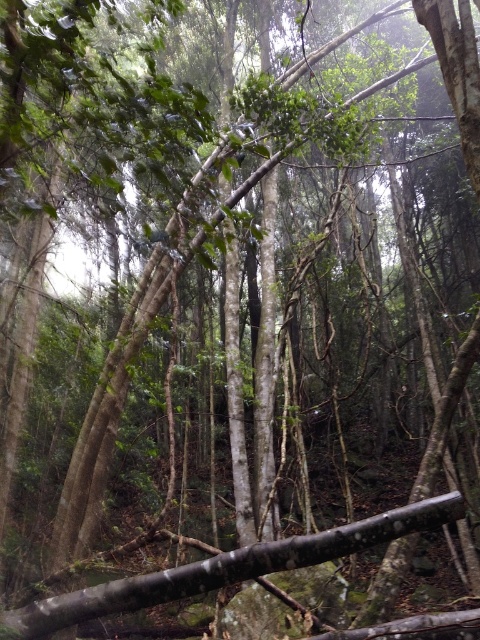
Question: Which of the following is the closest to the observer?

Choices:
 (A) (309, 608)
 (B) (197, 589)

Answer: (B)

Question: Is smooth brown branch at center wider than smooth brown rock at center?

Choices:
 (A) yes
 (B) no

Answer: (A)

Question: Which object appears farthest from the camera in this image?

Choices:
 (A) smooth brown rock at center
 (B) smooth brown branch at center

Answer: (A)

Question: Does smooth brown branch at center have a lesser width compared to smooth brown rock at center?

Choices:
 (A) yes
 (B) no

Answer: (B)

Question: Which point is closer to the camera?

Choices:
 (A) (311, 602)
 (B) (188, 573)

Answer: (B)

Question: Does smooth brown branch at center appear over smooth brown rock at center?

Choices:
 (A) no
 (B) yes

Answer: (B)